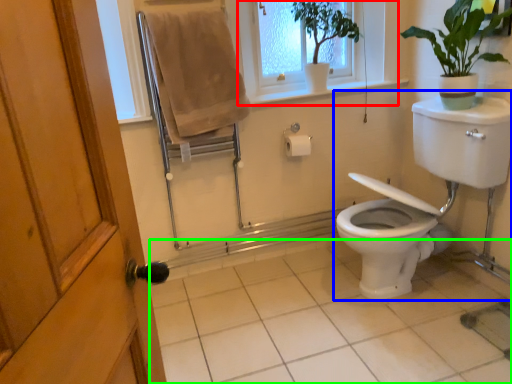
Question: Based on their relative distances, which object is nearer to window frame (highlighted by a red box)? Choose from sink (highlighted by a blue box) and tile (highlighted by a green box).

Choices:
 (A) sink
 (B) tile

Answer: (A)